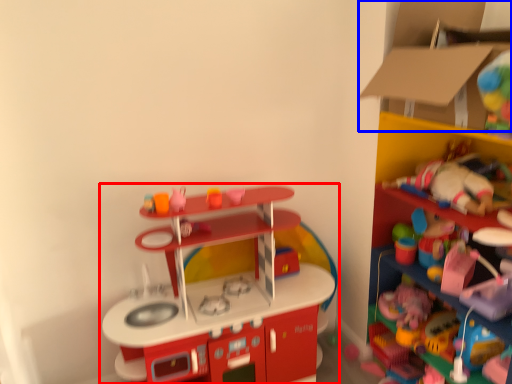
Question: Which object appears closest to the camera in this image, toy (highlighted by a red box) or cardboard box (highlighted by a blue box)?

Choices:
 (A) toy
 (B) cardboard box

Answer: (B)